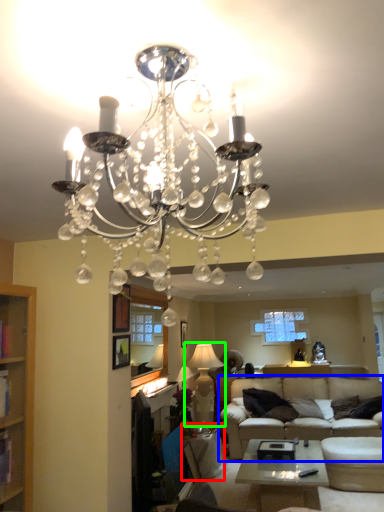
Question: Which object is positioned farthest from side table (highlighted by a red box)? Select from studio couch (highlighted by a blue box) and lamp (highlighted by a green box).

Choices:
 (A) studio couch
 (B) lamp

Answer: (B)